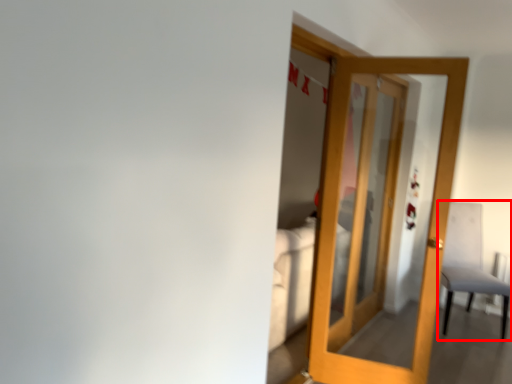
Question: From the image's perspective, considering the relative positions of chair (annotated by the red box) and door in the image provided, where is chair (annotated by the red box) located with respect to the staircase?

Choices:
 (A) below
 (B) above

Answer: (A)